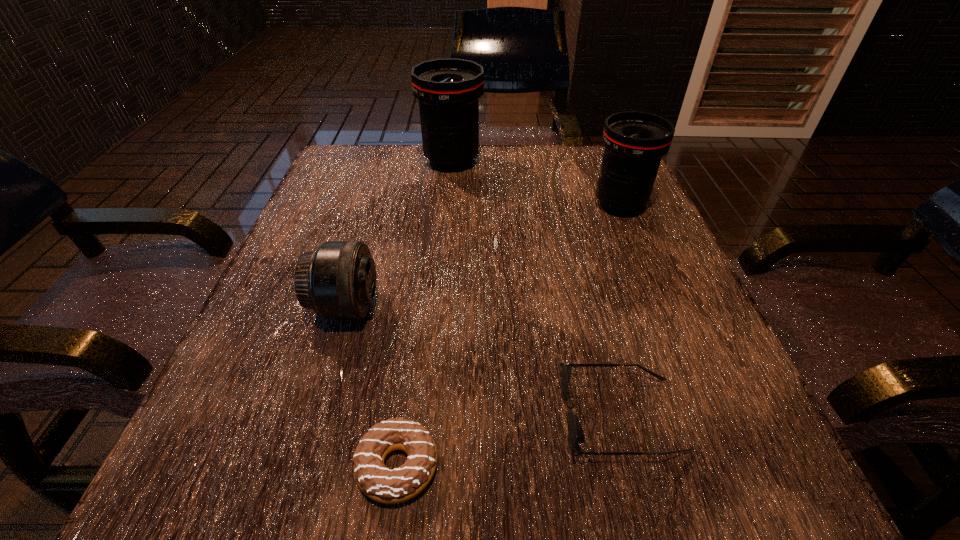
The height and width of the screenshot is (540, 960). I want to click on the second telephoto lens from right to left, so click(x=448, y=90).

Where is `the farthest telephoto lens`? The height and width of the screenshot is (540, 960). the farthest telephoto lens is located at coordinates (448, 90).

Find the location of `the second nearest telephoto lens`. the second nearest telephoto lens is located at coordinates (634, 142).

Image resolution: width=960 pixels, height=540 pixels. Find the location of `the rightmost telephoto lens`. the rightmost telephoto lens is located at coordinates click(634, 142).

Locate an element on the screen. The width and height of the screenshot is (960, 540). the leftmost object is located at coordinates (x=337, y=280).

Find the location of a particular element. the nearest telephoto lens is located at coordinates (337, 280).

Locate an element on the screen. sunglasses is located at coordinates (576, 435).

Identify the location of doughnut. (389, 486).

Find the location of a particular element. Image resolution: width=960 pixels, height=540 pixels. free space located 0.380m on the front of the farthest object is located at coordinates (439, 293).

Where is `free point located on the back of the rightmost telephoto lens`? The height and width of the screenshot is (540, 960). free point located on the back of the rightmost telephoto lens is located at coordinates (603, 163).